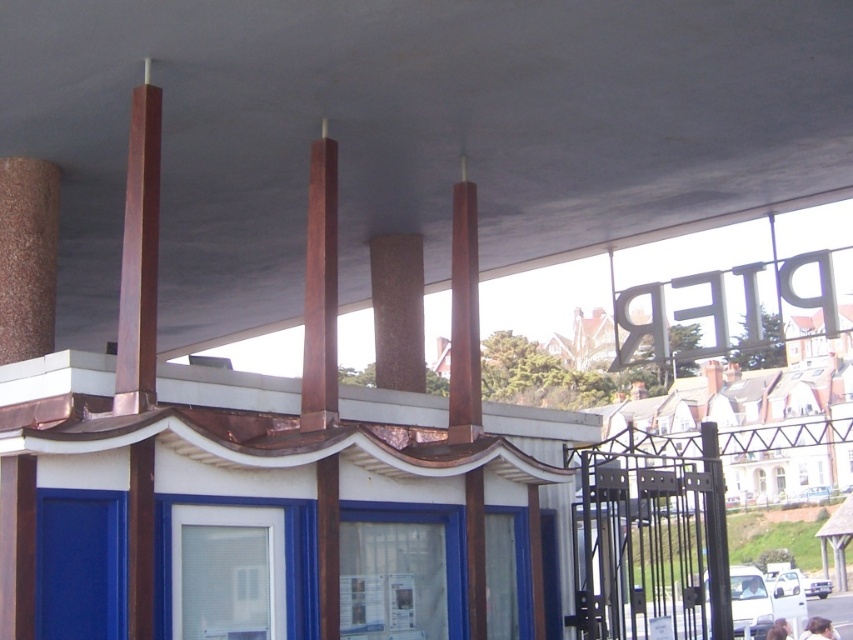
Question: Is brown textured chimney at left further to the viewer compared to brown polished pillar at center?

Choices:
 (A) no
 (B) yes

Answer: (A)

Question: Estimate the real-world distances between objects in this image. Which object is closer to the brown polished pillar at center?

Choices:
 (A) brown textured chimney at left
 (B) rustic wood beams at center

Answer: (B)

Question: Is rustic wood beams at center closer to the viewer compared to brown textured chimney at left?

Choices:
 (A) no
 (B) yes

Answer: (B)

Question: Which object is the closest to the brown polished pillar at center?

Choices:
 (A) brown textured chimney at left
 (B) rustic wood beams at center

Answer: (B)

Question: Can you confirm if brown textured chimney at left is positioned below brown polished pillar at center?

Choices:
 (A) no
 (B) yes

Answer: (A)

Question: Among these points, which one is farthest from the camera?

Choices:
 (A) (419, 337)
 (B) (38, 273)
 (C) (717, 80)

Answer: (A)